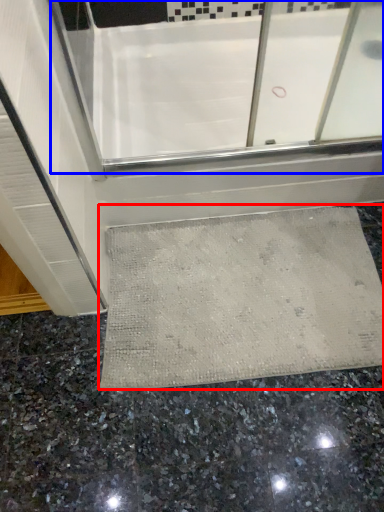
Question: Which object is closer to the camera taking this photo, bath mat (highlighted by a red box) or bath (highlighted by a blue box)?

Choices:
 (A) bath mat
 (B) bath

Answer: (A)